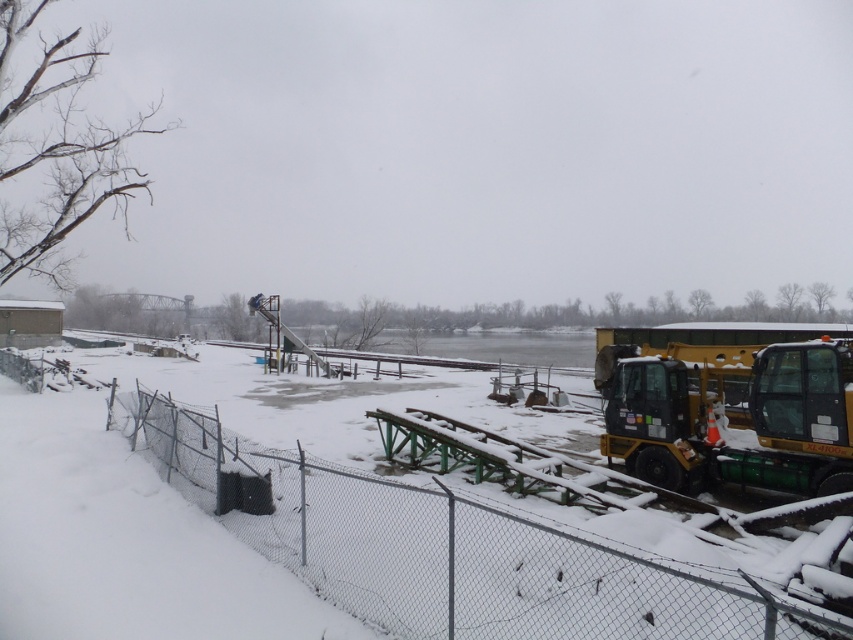
Is wire mesh fence at lower left positioned in front of yellow rubber plow at right?

Yes.

Between wire mesh fence at lower left and yellow rubber plow at right, which one is positioned lower?

wire mesh fence at lower left is lower down.

Who is more forward, (645, 628) or (689, 412)?

Point (645, 628) is more forward.

The width and height of the screenshot is (853, 640). I want to click on wire mesh fence at lower left, so click(450, 548).